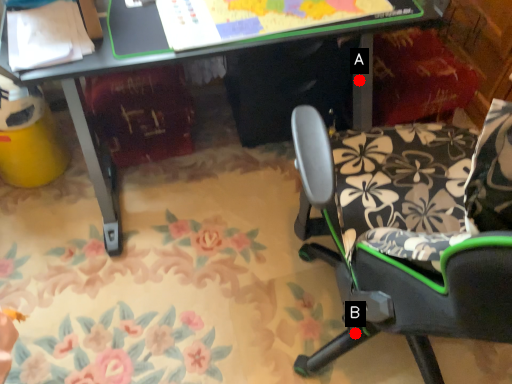
Question: Two points are circled on the image, labeled by A and B beside each circle. Among these points, which one is farthest from the camera?

Choices:
 (A) A is further
 (B) B is further

Answer: (A)